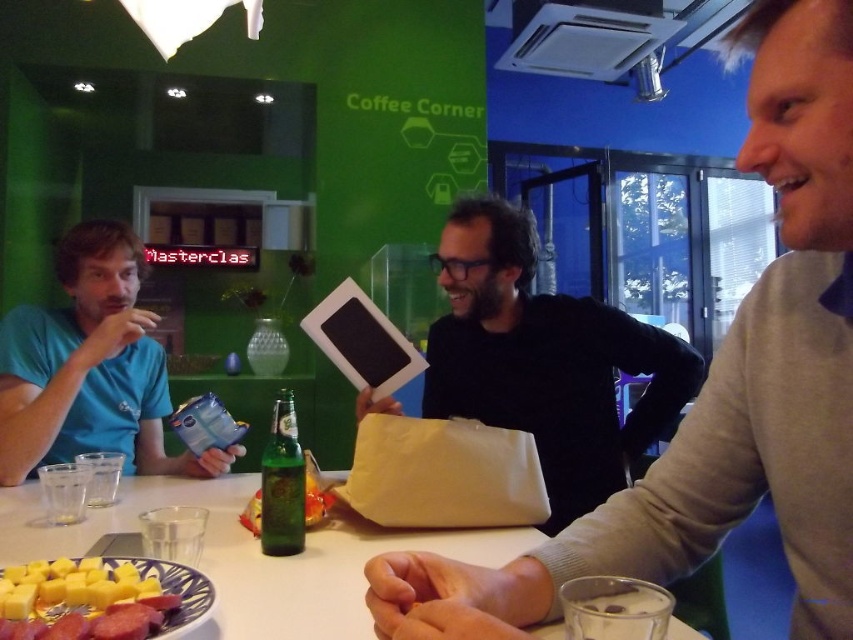
Question: Which object is closer to the camera taking this photo?

Choices:
 (A) white matte bag at center
 (B) white glossy table at center
 (C) yellow cheese cubes at lower left

Answer: (C)

Question: Which point appears farthest from the camera in this image?

Choices:
 (A) (108, 637)
 (B) (57, 413)
 (C) (316, 588)
 (D) (277, 413)

Answer: (B)

Question: Does white matte bag at center appear on the right side of white glossy table at center?

Choices:
 (A) yes
 (B) no

Answer: (A)

Question: Is smooth gray sweater at upper right above green glass bottle at center?

Choices:
 (A) no
 (B) yes

Answer: (B)

Question: Which point is farther from the camera taking this photo?

Choices:
 (A) (0, 353)
 (B) (521, 547)
 (C) (93, 588)

Answer: (A)

Question: Is blue matte t-shirt at left in front of yellow cheese cubes at lower left?

Choices:
 (A) no
 (B) yes

Answer: (A)